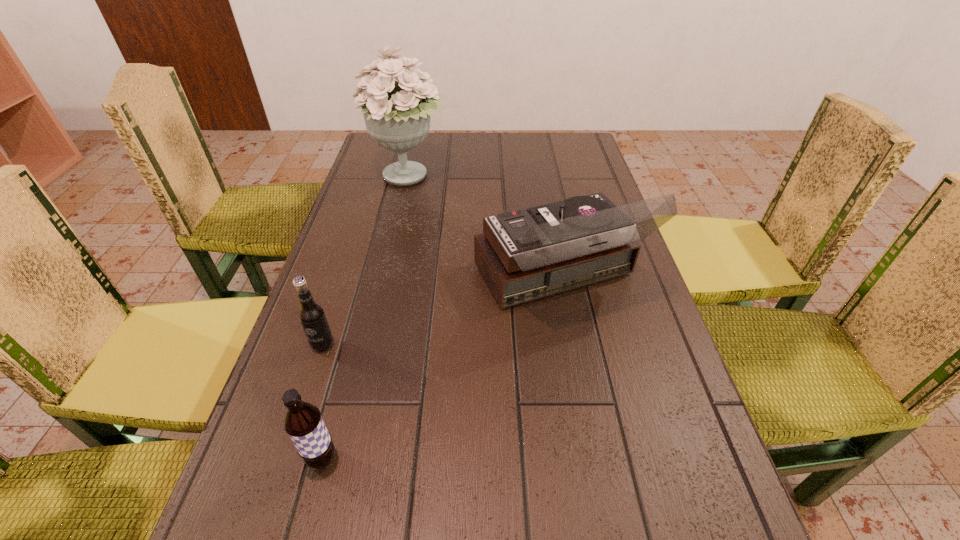
At what (x,y) coordinates should I click in order to perform the action: click on free point between the left root beer and the nearest object. Please return your answer as a coordinate pair (x, y). The image size is (960, 540). Looking at the image, I should click on (323, 402).

Identify the location of vacant area that lies between the tallest object and the record player. This screenshot has width=960, height=540. (482, 228).

This screenshot has width=960, height=540. I want to click on empty space that is in between the nearest object and the third shortest object, so click(439, 369).

At what (x,y) coordinates should I click in order to perform the action: click on free space between the nearest object and the record player. Please return your answer as a coordinate pair (x, y). This screenshot has height=540, width=960. Looking at the image, I should click on (439, 369).

Locate an element on the screen. The image size is (960, 540). empty location between the left root beer and the third shortest object is located at coordinates (440, 312).

Find the location of a particular element. vacant area between the third shortest object and the left root beer is located at coordinates (440, 312).

At what (x,y) coordinates should I click in order to perform the action: click on empty location between the farthest object and the nearest object. Please return your answer as a coordinate pair (x, y). Image resolution: width=960 pixels, height=540 pixels. Looking at the image, I should click on (366, 318).

Locate an element on the screen. This screenshot has height=540, width=960. unoccupied area between the farthest object and the nearer root beer is located at coordinates (366, 318).

Identify the location of free space between the right root beer and the rightmost object. The image size is (960, 540). (439, 369).

Locate an element on the screen. vacant area that lies between the farther root beer and the farthest object is located at coordinates tap(366, 261).